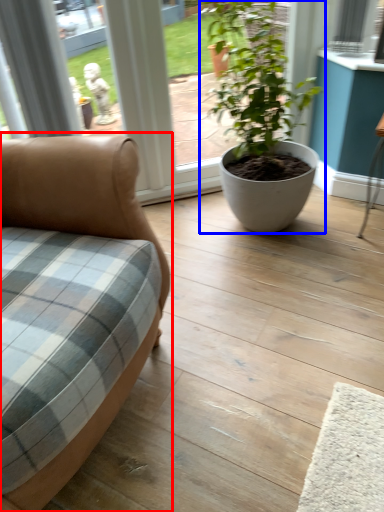
Question: Which of the following is the closest to the observer, studio couch (highlighted by a red box) or houseplant (highlighted by a blue box)?

Choices:
 (A) studio couch
 (B) houseplant

Answer: (A)